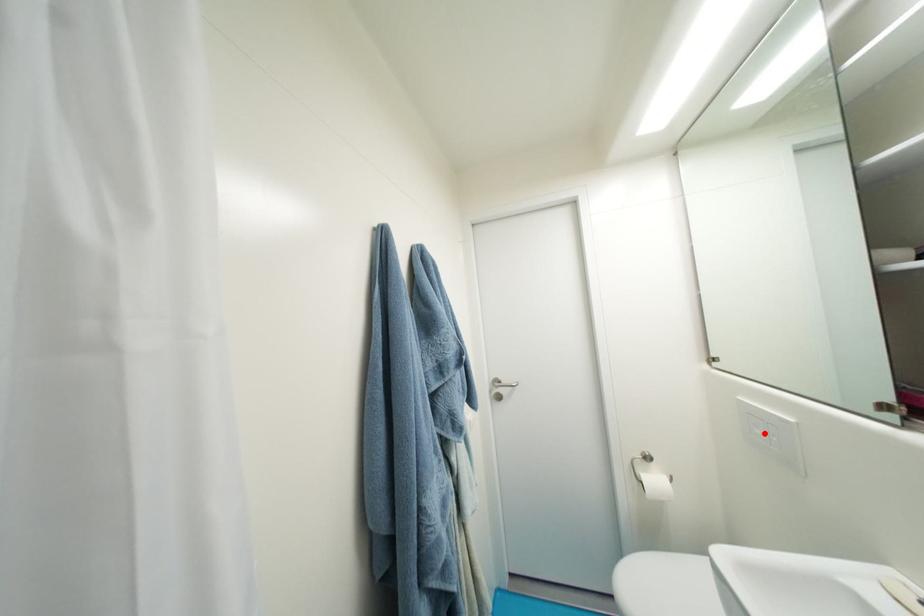
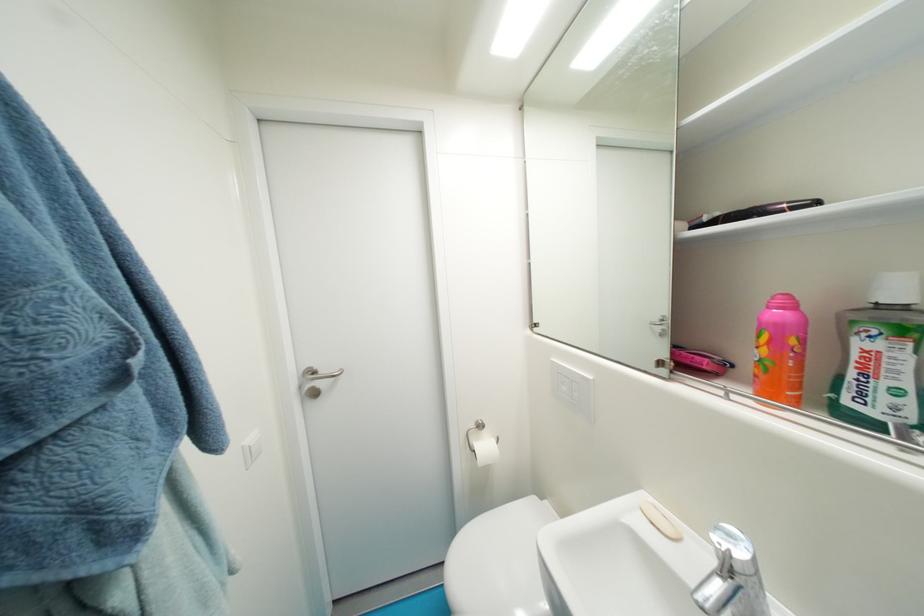
Where in the second image is the point corresponding to the highlighted location from the first image?

(570, 390)